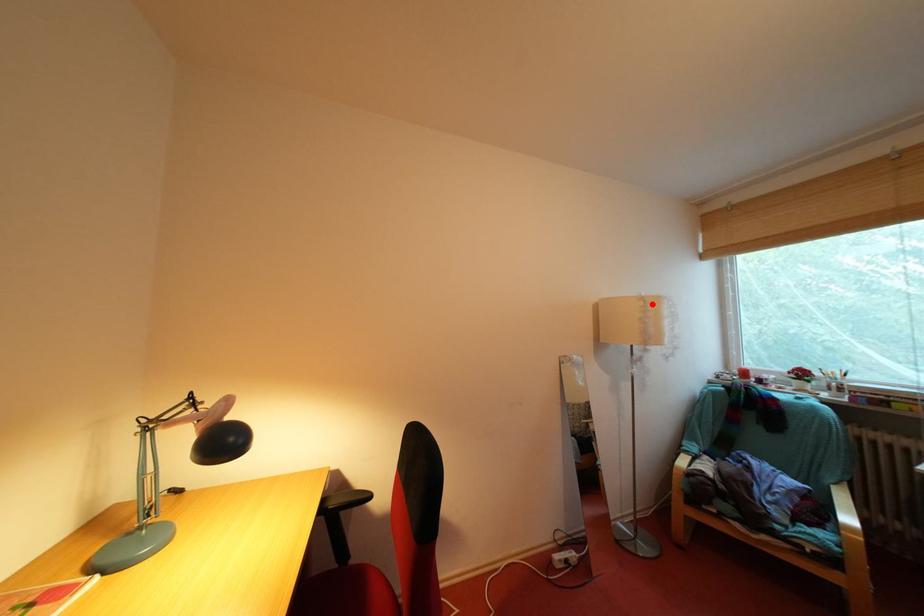
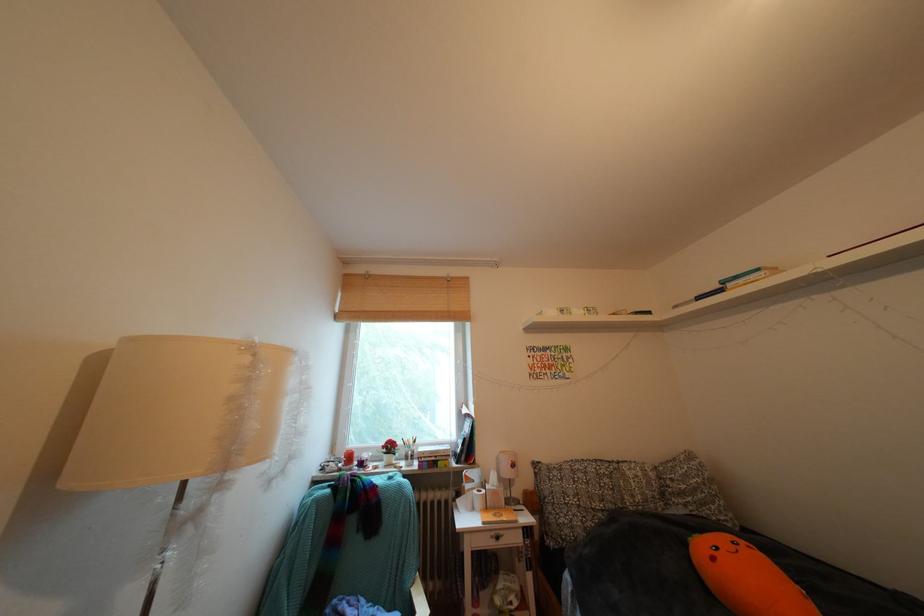
Question: I am providing you with two images of the same scene from different viewpoints. A red point is marked on the first image. Is the red point's position out of view in image 2?

Choices:
 (A) Yes
 (B) No

Answer: (B)